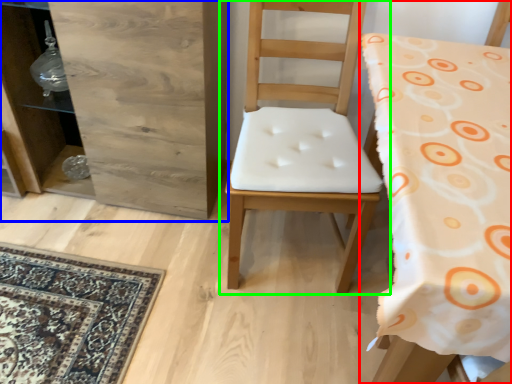
Question: Estimate the real-world distances between objects in this image. Which object is closer to chair (highlighted by a red box), dresser (highlighted by a blue box) or chair (highlighted by a green box)?

Choices:
 (A) dresser
 (B) chair

Answer: (B)